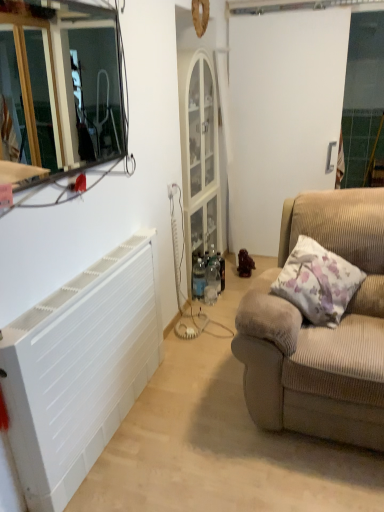
Identify the location of free spot in front of white plastic radiator at left. (145, 465).